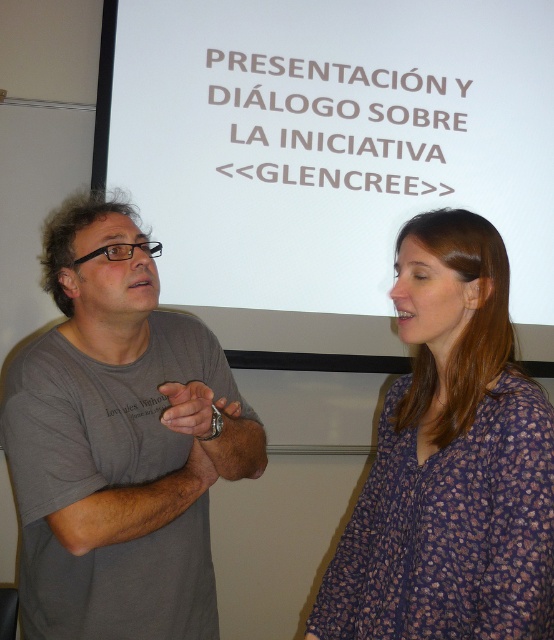
Question: Which object is closer to the camera taking this photo?

Choices:
 (A) gray cotton t-shirt at left
 (B) white matte projection screen at upper center
 (C) purple floral blouse at center

Answer: (C)

Question: Does gray cotton t-shirt at left have a larger size compared to purple floral blouse at center?

Choices:
 (A) yes
 (B) no

Answer: (A)

Question: Which is nearer to the white matte projection screen at upper center?

Choices:
 (A) gray cotton t-shirt at left
 (B) purple floral blouse at center

Answer: (A)

Question: Does white matte projection screen at upper center appear on the left side of gray cotton t-shirt at left?

Choices:
 (A) no
 (B) yes

Answer: (A)

Question: Is white matte projection screen at upper center below gray cotton t-shirt at left?

Choices:
 (A) yes
 (B) no

Answer: (B)

Question: Which of these objects is positioned closest to the gray cotton t-shirt at left?

Choices:
 (A) white matte projection screen at upper center
 (B) purple floral blouse at center

Answer: (B)